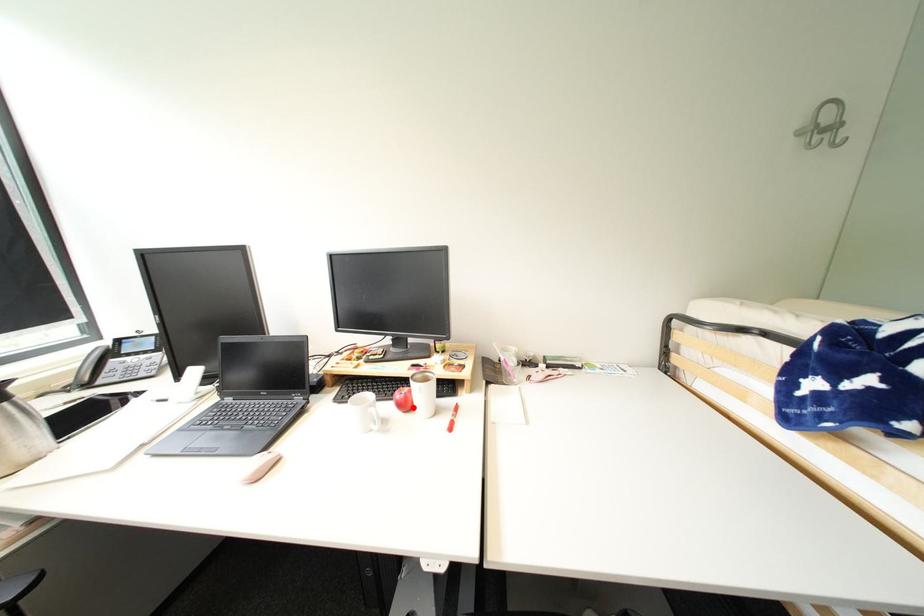
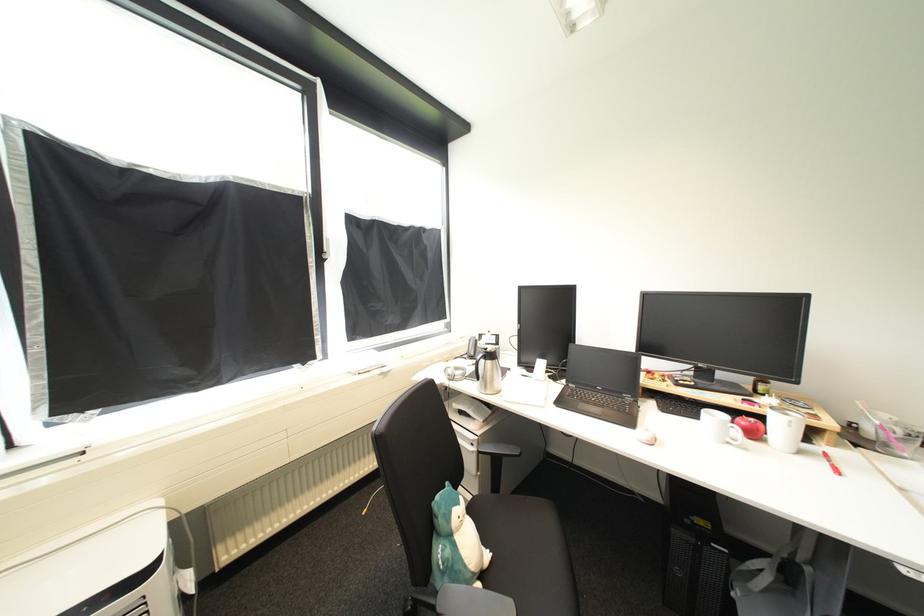
Question: I am providing you with two images of the same scene from different viewpoints. Image1 has a red point marked. In image2, the corresponding 3D location appears at what relative position? Reply with the corresponding letter.

Choices:
 (A) Closer
 (B) Farther

Answer: (A)